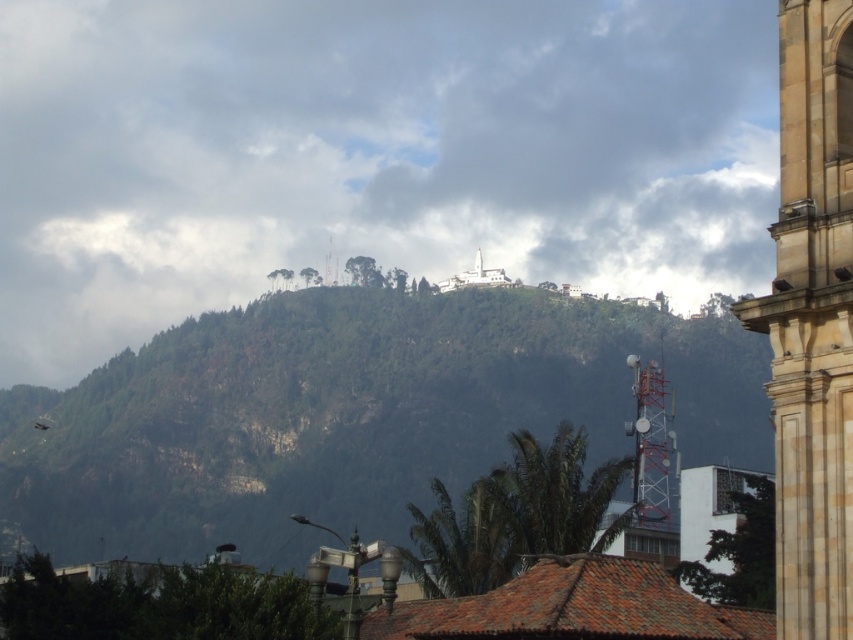
You are standing in front of the image and want to know which of the two points, point (392, 490) or point (492, 273), is nearer to you. Can you tell me which one?

Point (392, 490) is closer to the camera than point (492, 273), so it is the nearer one.

You are an architect designing a new observation deck. You want to ensure visitors can see the white marble church at upper center without obstruction. Based on the scene, is the green forested hill at center blocking the view of the church?

The green forested hill at center is below the white marble church at upper center, so the hill is positioned lower than the church. This means the church is elevated above the hill and should be visible without obstruction from the observation deck.

You are standing in the scenic view looking at the two points marked in the image. Which point is closer to you, point (x=260, y=349) or point (x=824, y=436)?

Point (x=260, y=349) is closer to you because it is further to the viewer than point (x=824, y=436).